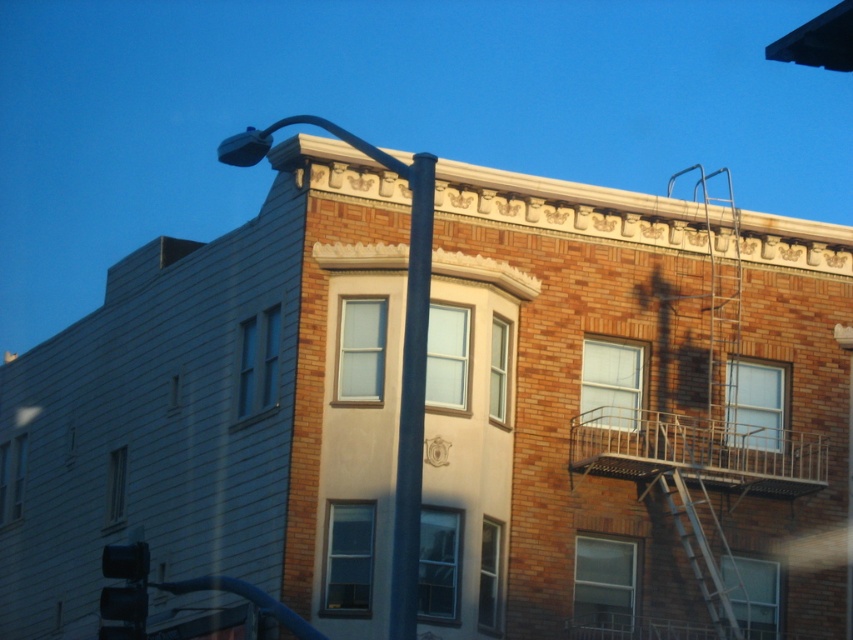
Where is `metallic pole at center`? The image size is (853, 640). metallic pole at center is located at coordinates (402, 355).

Does metallic pole at center appear over smooth black pole at center?

Yes.

Between point (409, 182) and point (395, 500), which one is positioned in front?

Positioned in front is point (409, 182).

Where is `metallic pole at center`? The image size is (853, 640). metallic pole at center is located at coordinates (402, 355).

This screenshot has height=640, width=853. I want to click on smooth black pole at center, so click(410, 403).

Does point (416, 353) lie in front of point (131, 595)?

That is True.

Between point (415, 602) and point (131, 628), which one is positioned in front?

Point (415, 602)

The width and height of the screenshot is (853, 640). Find the location of `smooth black pole at center`. smooth black pole at center is located at coordinates (410, 403).

Can you confirm if smooth black pole at center is thinner than silver metallic ladder at right?

No, smooth black pole at center is not thinner than silver metallic ladder at right.

Which is below, smooth black pole at center or silver metallic ladder at right?

silver metallic ladder at right is below.

Is point (393, 563) closer to camera compared to point (721, 624)?

Yes, point (393, 563) is closer to viewer.

Identify the location of smooth black pole at center. This screenshot has width=853, height=640. 410,403.